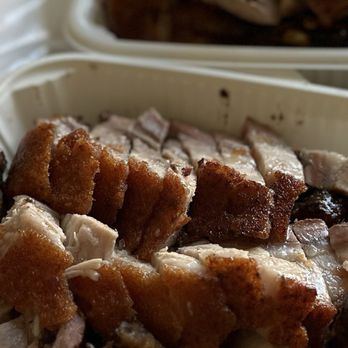
Where is `table`? table is located at coordinates (286, 75).